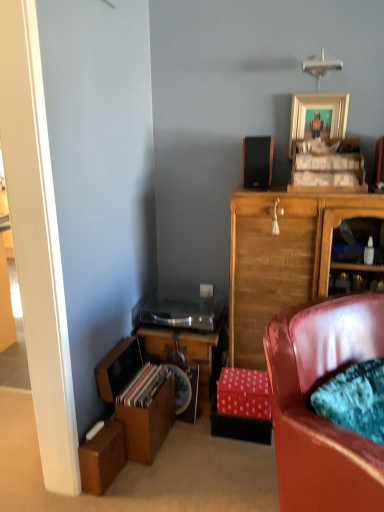
Image resolution: width=384 pixels, height=512 pixels. What are the coordinates of `vacant region to the right of brown cardboard box at lower left, acting as the second cardboard box starting from the right` in the screenshot? It's located at (140, 480).